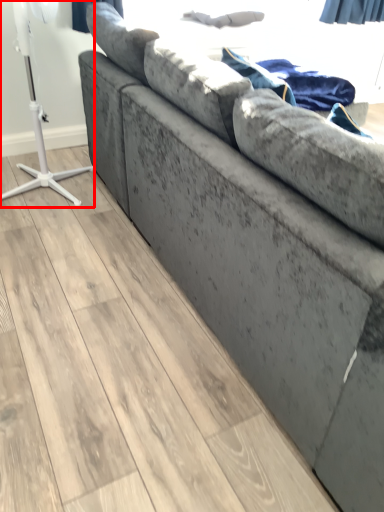
Question: From the image's perspective, what is the correct spatial relationship of table lamp (annotated by the red box) in relation to blanket?

Choices:
 (A) below
 (B) above

Answer: (A)